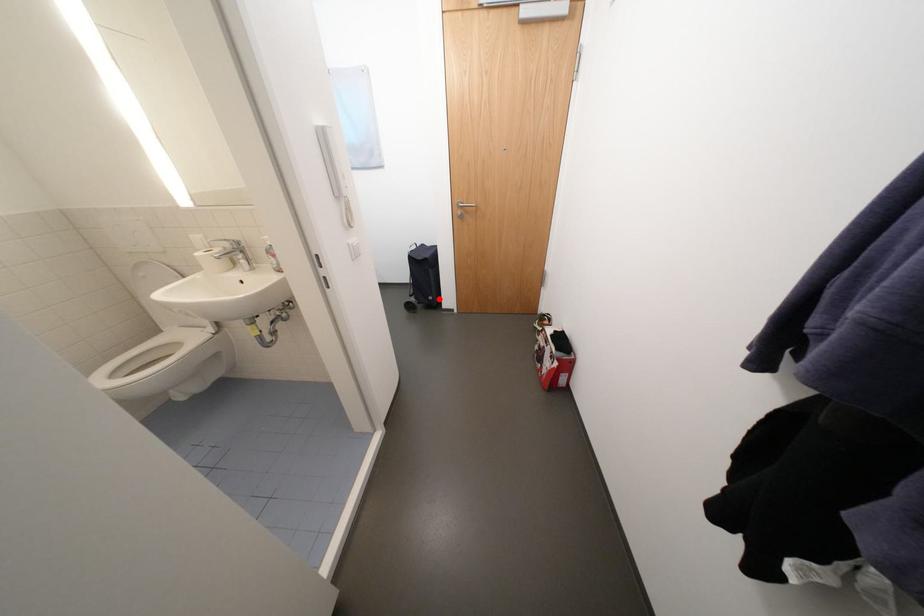
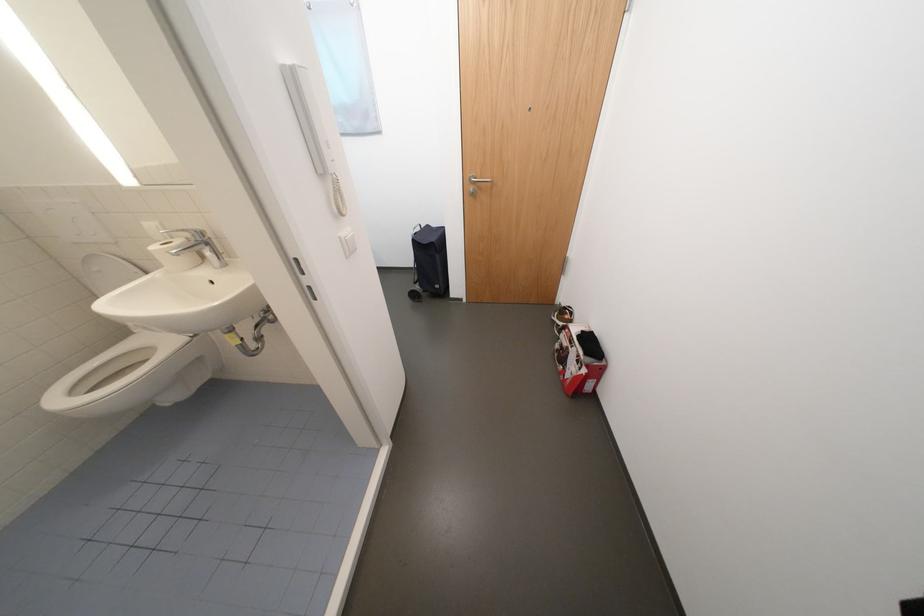
Question: A red point is marked in image1. In image2, is the corresponding 3D point closer to the camera or farther? Reply with the corresponding letter.

Choices:
 (A) The corresponding 3D point is closer.
 (B) The corresponding 3D point is farther.

Answer: (B)